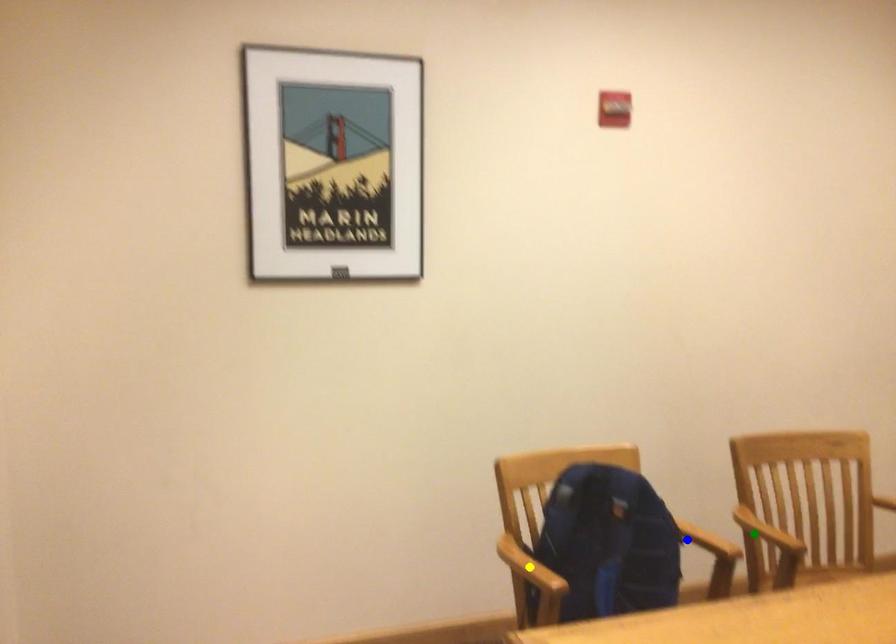
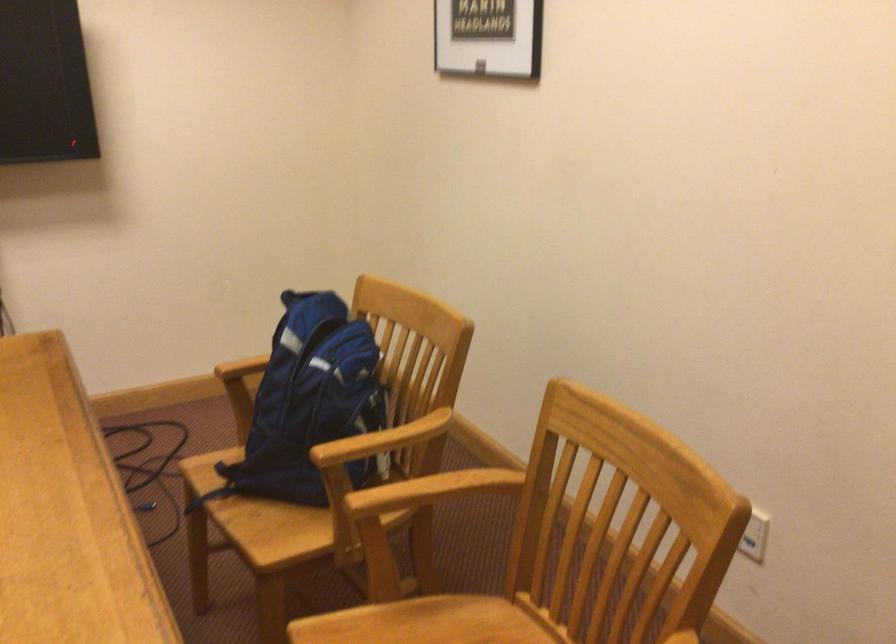
I am providing you with two images of the same scene from different viewpoints. Three points are marked in image1. Which point corresponds to a part or object that is occluded in image2?In image1, three points are marked. Which of them correspond to a part or object that is occluded in image2?Among the three points shown in image1, which one corresponds to a part or object that is no longer visible due to occlusion in image2?

Invisible in image2: yellow point.